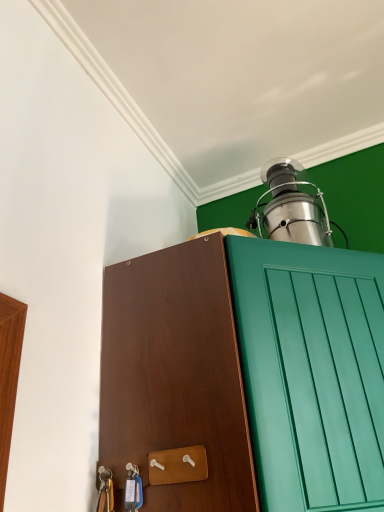
Describe the element at coordinates (290, 207) in the screenshot. I see `stainless steel oil lamp at upper right` at that location.

What is the approximate width of stainless steel oil lamp at upper right?

stainless steel oil lamp at upper right is 5.33 inches wide.

Measure the distance between point (290, 189) and camera.

Point (290, 189) and camera are 1.26 meters apart.

I want to click on stainless steel oil lamp at upper right, so click(x=290, y=207).

You are a GUI agent. You are given a task and a screenshot of the screen. Output one action in this format:
    pyautogui.click(x=<x>, y=<y>)
    Task: Click on the brown wood cabinet at center
    
    Given the screenshot: What is the action you would take?
    pyautogui.click(x=247, y=371)

This screenshot has height=512, width=384. What do you see at coordinates (247, 371) in the screenshot?
I see `brown wood cabinet at center` at bounding box center [247, 371].

Locate an element on the screen. This screenshot has width=384, height=512. stainless steel oil lamp at upper right is located at coordinates (290, 207).

Would you say stainless steel oil lamp at upper right is to the left or to the right of brown wood cabinet at center in the picture?

Clearly, stainless steel oil lamp at upper right is on the right of brown wood cabinet at center in the image.

Does stainless steel oil lamp at upper right lie behind brown wood cabinet at center?

Yes, the depth of stainless steel oil lamp at upper right is greater than that of brown wood cabinet at center.

Which is in front, point (290, 202) or point (351, 357)?

The point (351, 357) is more forward.

From the image's perspective, who appears lower, stainless steel oil lamp at upper right or brown wood cabinet at center?

brown wood cabinet at center, from the image's perspective.

From a real-world perspective, does stainless steel oil lamp at upper right sit lower than brown wood cabinet at center?

Incorrect, from a real-world perspective, stainless steel oil lamp at upper right is higher than brown wood cabinet at center.

Considering the relative sizes of stainless steel oil lamp at upper right and brown wood cabinet at center in the image provided, is stainless steel oil lamp at upper right wider than brown wood cabinet at center?

Incorrect, the width of stainless steel oil lamp at upper right does not surpass that of brown wood cabinet at center.

In the scene shown: Is stainless steel oil lamp at upper right taller than brown wood cabinet at center?

No, stainless steel oil lamp at upper right is not taller than brown wood cabinet at center.

Can you confirm if stainless steel oil lamp at upper right is bigger than brown wood cabinet at center?

Actually, stainless steel oil lamp at upper right might be smaller than brown wood cabinet at center.

Would you say stainless steel oil lamp at upper right is inside or outside brown wood cabinet at center?

The correct answer is: outside.

Is stainless steel oil lamp at upper right placed right next to brown wood cabinet at center?

stainless steel oil lamp at upper right and brown wood cabinet at center are not in contact.

Is stainless steel oil lamp at upper right oriented towards brown wood cabinet at center?

No.

What's the angular difference between stainless steel oil lamp at upper right and brown wood cabinet at center's facing directions?

The angular difference between stainless steel oil lamp at upper right and brown wood cabinet at center is 0.000192 degrees.

Identify the location of oil lamp behind the brown wood cabinet at center. The height and width of the screenshot is (512, 384). (290, 207).

Is brown wood cabinet at center at the left side of stainless steel oil lamp at upper right?

Yes.

Between brown wood cabinet at center and stainless steel oil lamp at upper right, which one is positioned in front?

brown wood cabinet at center is in front.

Does point (198, 507) appear closer or farther from the camera than point (271, 216)?

Point (198, 507) appears to be closer to the viewer than point (271, 216).

From the image's perspective, which one is positioned higher, brown wood cabinet at center or stainless steel oil lamp at upper right?

stainless steel oil lamp at upper right is shown above in the image.

Based on the photo, from a real-world perspective, is brown wood cabinet at center on top of stainless steel oil lamp at upper right?

Actually, brown wood cabinet at center is physically below stainless steel oil lamp at upper right in the real world.

Considering the sizes of objects brown wood cabinet at center and stainless steel oil lamp at upper right in the image provided, who is thinner, brown wood cabinet at center or stainless steel oil lamp at upper right?

With smaller width is stainless steel oil lamp at upper right.

Can you confirm if brown wood cabinet at center is taller than stainless steel oil lamp at upper right?

Yes, brown wood cabinet at center is taller than stainless steel oil lamp at upper right.

Considering the sizes of brown wood cabinet at center and stainless steel oil lamp at upper right in the image, is brown wood cabinet at center bigger or smaller than stainless steel oil lamp at upper right?

brown wood cabinet at center is bigger than stainless steel oil lamp at upper right.

Is brown wood cabinet at center situated inside stainless steel oil lamp at upper right or outside?

brown wood cabinet at center is spatially situated outside stainless steel oil lamp at upper right.

In the scene shown: Would you say brown wood cabinet at center is a long distance from stainless steel oil lamp at upper right?

No, brown wood cabinet at center is not far away from stainless steel oil lamp at upper right.

Could you tell me if brown wood cabinet at center is facing stainless steel oil lamp at upper right?

No, brown wood cabinet at center does not turn towards stainless steel oil lamp at upper right.

Find the location of a particular element. This screenshot has height=512, width=384. cabinetry below the stainless steel oil lamp at upper right (from a real-world perspective) is located at coordinates (247, 371).

Image resolution: width=384 pixels, height=512 pixels. I want to click on cabinetry on the left side of stainless steel oil lamp at upper right, so click(247, 371).

At what (x,y) coordinates should I click in order to perform the action: click on oil lamp lying on the right of brown wood cabinet at center. Please return your answer as a coordinate pair (x, y). This screenshot has height=512, width=384. Looking at the image, I should click on (290, 207).